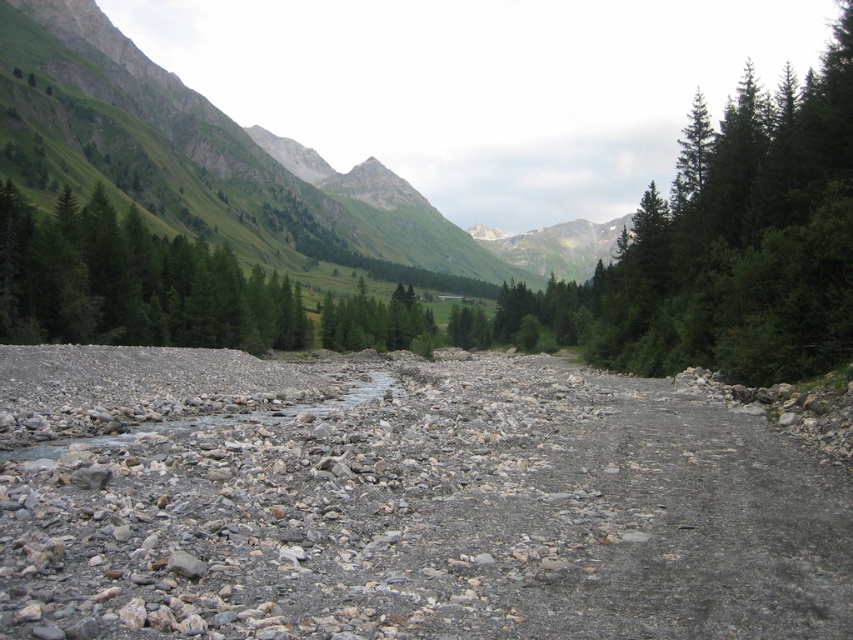
Question: Can you confirm if gray gravel bed at center is positioned below green matte tree at center?

Choices:
 (A) yes
 (B) no

Answer: (A)

Question: Is gray gravel bed at center above green matte tree at left?

Choices:
 (A) no
 (B) yes

Answer: (A)

Question: Can you confirm if gray gravel bed at center is wider than green matte tree at center?

Choices:
 (A) yes
 (B) no

Answer: (A)

Question: Among these points, which one is farthest from the camera?

Choices:
 (A) (418, 307)
 (B) (207, 288)

Answer: (A)

Question: Which object is closer to the camera taking this photo?

Choices:
 (A) gray gravel bed at center
 (B) green matte tree at center

Answer: (A)

Question: Which of the following is the closest to the observer?

Choices:
 (A) (161, 326)
 (B) (20, 624)
 (C) (427, 356)

Answer: (B)